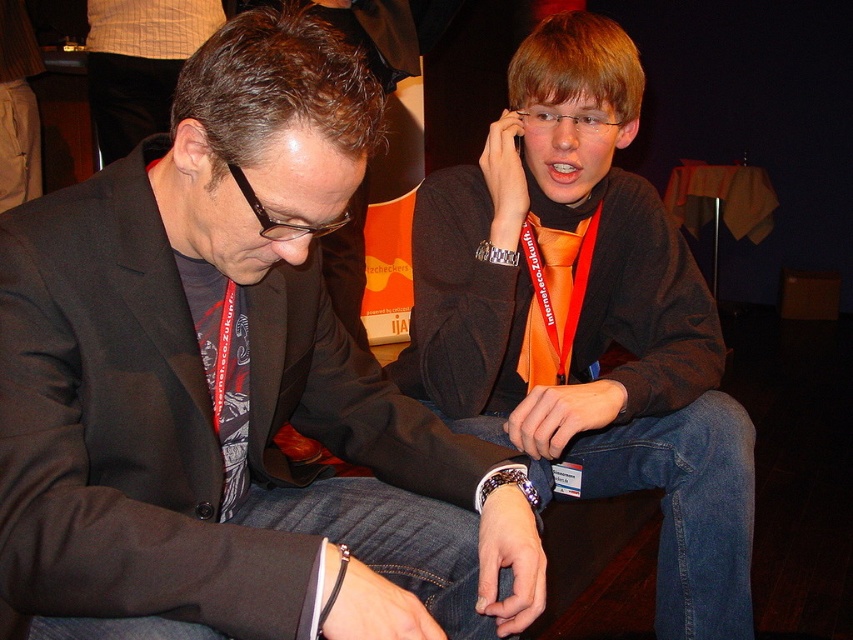
Question: Does matte black jacket at center appear on the left side of orange fabric tie at center?

Choices:
 (A) yes
 (B) no

Answer: (A)

Question: Among these objects, which one is nearest to the camera?

Choices:
 (A) orange satin tie at center
 (B) orange fabric tie at center
 (C) matte black jacket at center

Answer: (C)

Question: Does matte black jacket at center appear over orange fabric tie at center?

Choices:
 (A) no
 (B) yes

Answer: (A)

Question: Is matte black jacket at center wider than orange fabric tie at center?

Choices:
 (A) no
 (B) yes

Answer: (A)

Question: Which is nearer to the matte black jacket at center?

Choices:
 (A) orange satin tie at center
 (B) orange fabric tie at center

Answer: (B)

Question: Which is nearer to the matte black jacket at center?

Choices:
 (A) orange fabric tie at center
 (B) orange satin tie at center

Answer: (A)